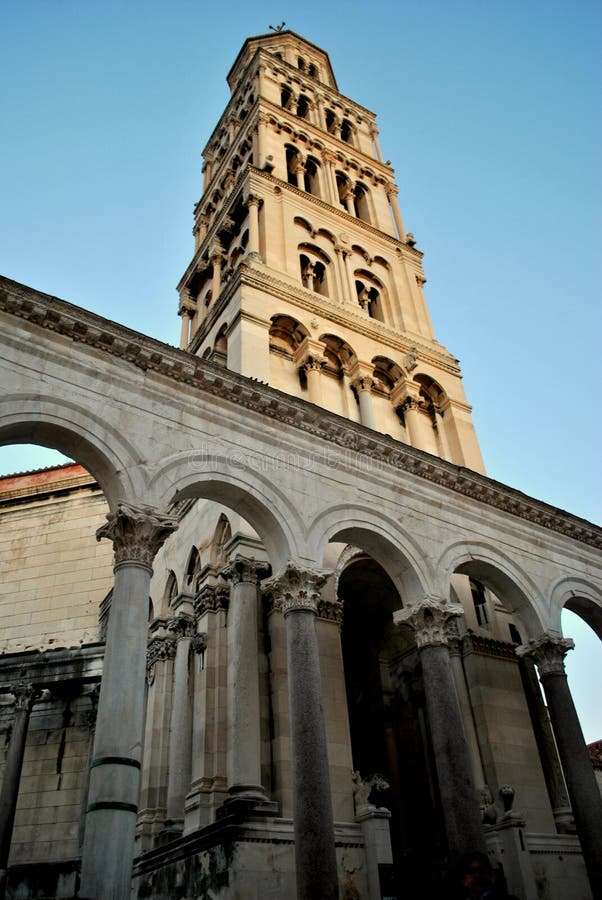
Identify the location of pillars 4th floor. (x=298, y=177), (x=349, y=202), (x=230, y=187), (x=203, y=229).